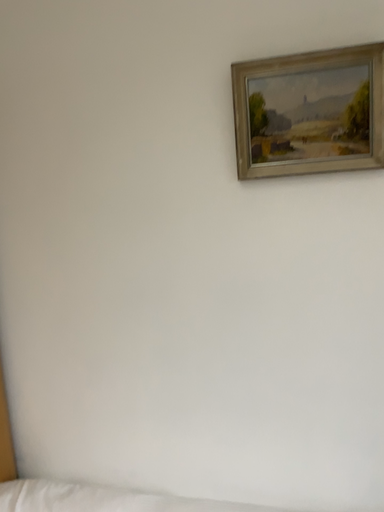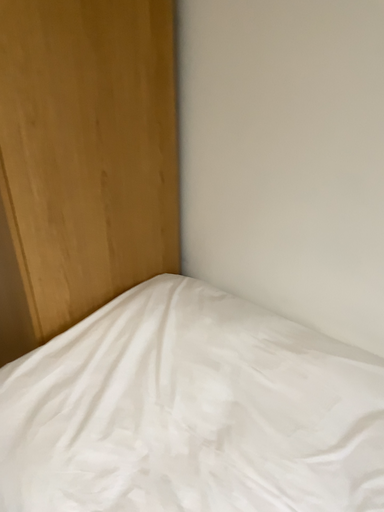
Question: Which way did the camera rotate in the video?

Choices:
 (A) rotated downward
 (B) rotated upward

Answer: (A)